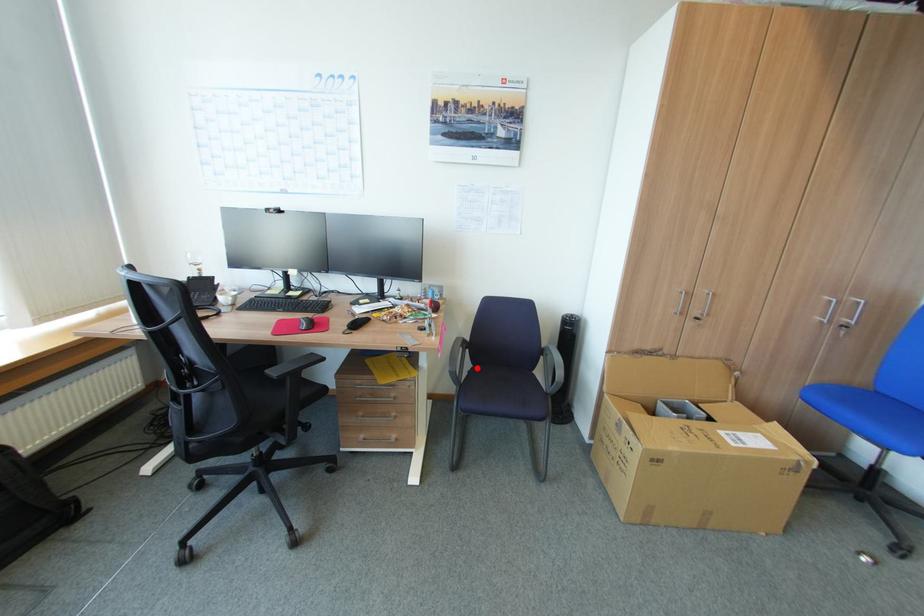
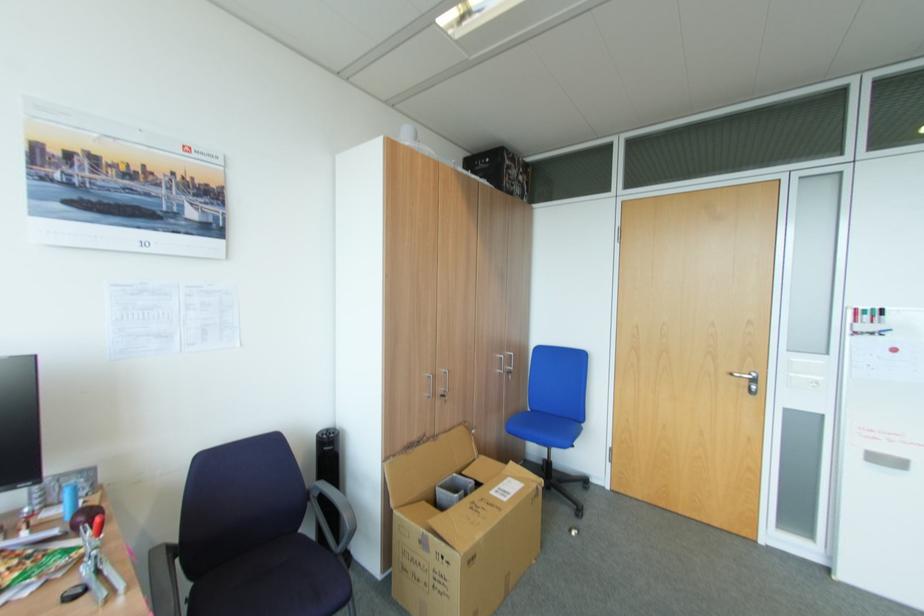
Question: I am providing you with two images of the same scene from different viewpoints. A red point is shown in image1. For the corresponding object point in image2, is it positioned nearer or farther from the camera?

Choices:
 (A) Nearer
 (B) Farther

Answer: (B)